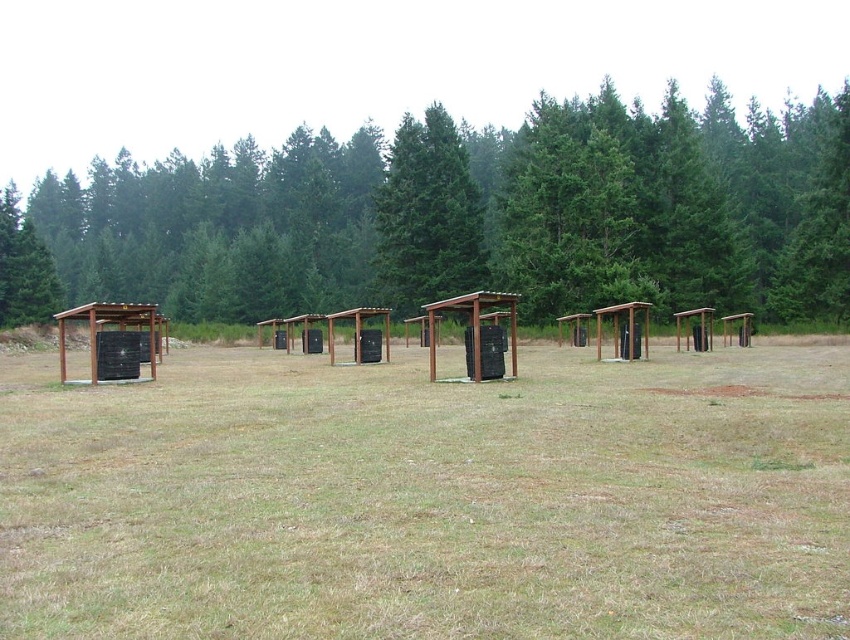
The width and height of the screenshot is (850, 640). In order to click on green textured trees at upper center in this screenshot , I will do `click(469, 216)`.

Is green textured trees at upper center thinner than brown wooden shelter at center?

No.

Is point (531, 282) farther from viewer compared to point (479, 307)?

That is True.

Image resolution: width=850 pixels, height=640 pixels. What are the coordinates of `green textured trees at upper center` in the screenshot? It's located at (469, 216).

Describe the element at coordinates (469, 216) in the screenshot. The width and height of the screenshot is (850, 640). I see `green textured trees at upper center` at that location.

Is green textured trees at upper center to the left of matte black shelter at left from the viewer's perspective?

No, green textured trees at upper center is not to the left of matte black shelter at left.

This screenshot has width=850, height=640. I want to click on green textured trees at upper center, so click(469, 216).

Does point (139, 333) come closer to viewer compared to point (442, 301)?

No, it is behind (442, 301).

Between point (91, 365) and point (514, 304), which one is positioned in front?

Positioned in front is point (514, 304).

Is point (122, 365) positioned after point (500, 296)?

That is True.

This screenshot has height=640, width=850. Find the location of `matte black shelter at left`. matte black shelter at left is located at coordinates (112, 340).